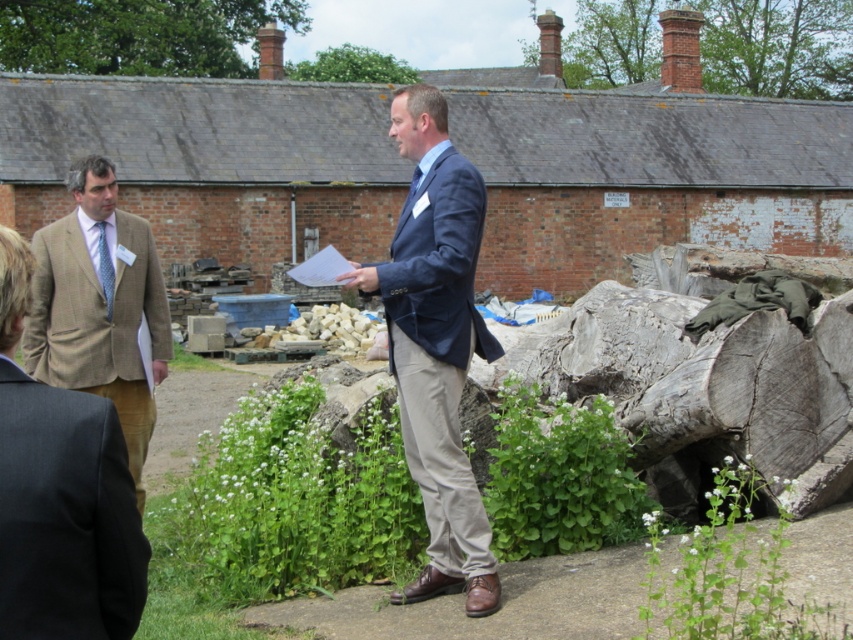
Who is positioned more to the left, velvet blue blazer at center or brown tweed blazer at left?

brown tweed blazer at left is more to the left.

Does velvet blue blazer at center have a smaller size compared to brown tweed blazer at left?

No.

I want to click on velvet blue blazer at center, so click(436, 344).

Is velvet blue blazer at center smaller than brown tweed suit at left?

Indeed, velvet blue blazer at center has a smaller size compared to brown tweed suit at left.

Between point (410, 324) and point (117, 394), which one is positioned behind?

The point (117, 394) is more distant.

Does point (469, 604) come in front of point (115, 385)?

Yes, point (469, 604) is in front of point (115, 385).

Locate an element on the screen. velvet blue blazer at center is located at coordinates (436, 344).

At what (x,y) coordinates should I click in order to perform the action: click on brown tweed blazer at left. Please return your answer as a coordinate pair (x, y). This screenshot has width=853, height=640. Looking at the image, I should click on (61, 493).

Can you confirm if brown tweed blazer at left is positioned above brown tweed suit at left?

Incorrect, brown tweed blazer at left is not positioned above brown tweed suit at left.

Does point (122, 506) come farther from viewer compared to point (51, 332)?

That is False.

Identify the location of brown tweed blazer at left. (61, 493).